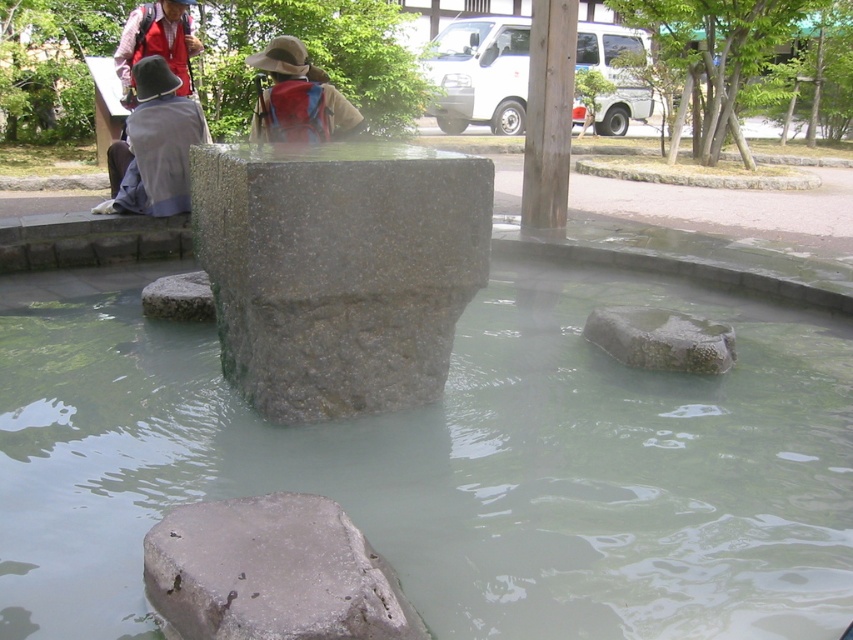
You are a visitor at the onsen and want to step into the water. Considering the clear stone water at center and the gray granite stone at center, which one has a wider spread in the scene?

The clear stone water at center has a wider spread than the gray granite stone at center, as its width surpasses that of the gray granite stone at center.

You are standing at the edge of the hot spring and see the smooth gray stone at center and the red backpack at upper center. Which object is closer to your right side?

The smooth gray stone at center is to the right of the red backpack at upper center, so it is closer to your right side.